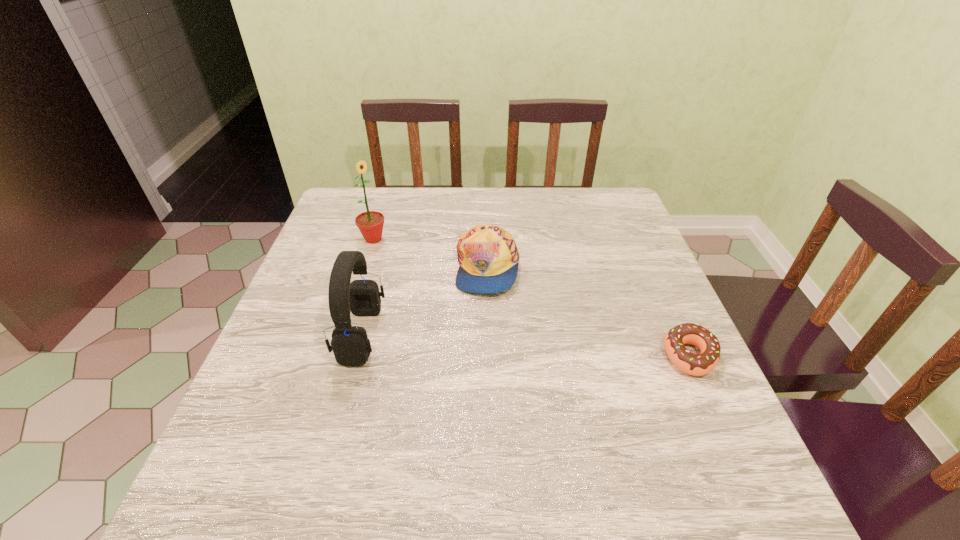
The height and width of the screenshot is (540, 960). In order to click on vacant region between the tallest object and the shortest object in this screenshot , I will do `click(532, 298)`.

Identify the location of free space that is in between the shortest object and the tallest object. The height and width of the screenshot is (540, 960). (532, 298).

Image resolution: width=960 pixels, height=540 pixels. What are the coordinates of `free area in between the tallest object and the doughnut` in the screenshot? It's located at (532, 298).

The height and width of the screenshot is (540, 960). I want to click on unoccupied area between the sunflower and the third tallest object, so click(x=431, y=253).

Choose which object is the third nearest neighbor to the rightmost object. Please provide its 2D coordinates. Your answer should be formatted as a tuple, i.e. [(x, y)], where the tuple contains the x and y coordinates of a point satisfying the conditions above.

[(370, 223)]

This screenshot has height=540, width=960. What are the coordinates of `the third closest object to the sunflower` in the screenshot? It's located at (701, 364).

Locate an element on the screen. The height and width of the screenshot is (540, 960). blank area in the image that satisfies the following two spatial constraints: 1. on the front side of the rightmost object; 2. on the right side of the cap is located at coordinates (490, 356).

Find the location of a particular element. The height and width of the screenshot is (540, 960). free spot that satisfies the following two spatial constraints: 1. on the front side of the tallest object; 2. on the headband of the headset is located at coordinates (344, 334).

Where is `vacant space that satisfies the following two spatial constraints: 1. on the front side of the doughnut; 2. on the right side of the cap`? The width and height of the screenshot is (960, 540). vacant space that satisfies the following two spatial constraints: 1. on the front side of the doughnut; 2. on the right side of the cap is located at coordinates (490, 356).

Find the location of a particular element. The width and height of the screenshot is (960, 540). vacant space that satisfies the following two spatial constraints: 1. on the front side of the rightmost object; 2. on the left side of the tallest object is located at coordinates (337, 356).